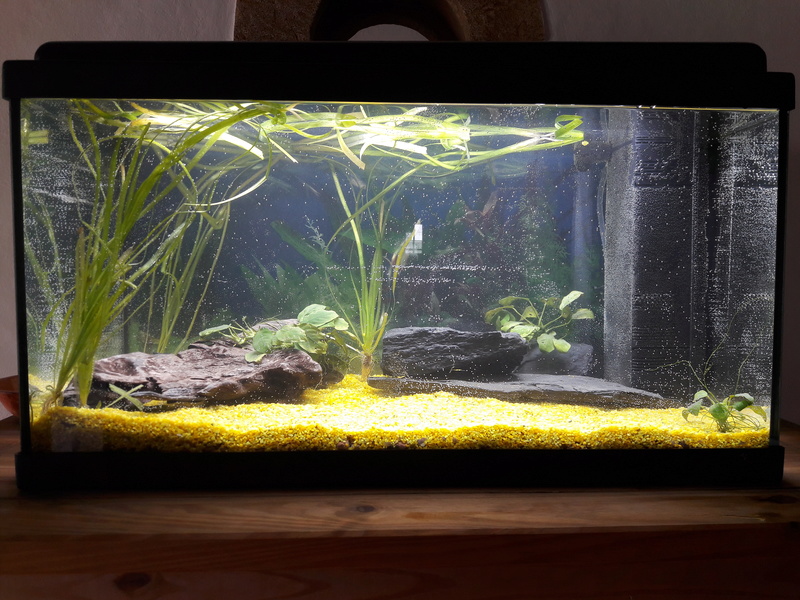
The image size is (800, 600). Find the location of `place aquarium tank is sitting`. place aquarium tank is sitting is located at coordinates (265, 518).